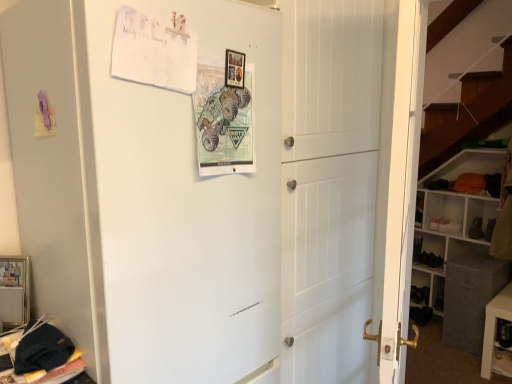
Question: Considering the relative sizes of black leather shoe at lower right, which ranks as the first shoe in right-to-left order, and white matte refrigerator at upper left in the image provided, is black leather shoe at lower right, which ranks as the first shoe in right-to-left order, smaller than white matte refrigerator at upper left?

Choices:
 (A) no
 (B) yes

Answer: (B)

Question: Is the position of black leather shoe at lower right, which ranks as the first shoe in right-to-left order, more distant than that of white matte refrigerator at upper left?

Choices:
 (A) yes
 (B) no

Answer: (A)

Question: Is black leather shoe at lower right, which ranks as the first shoe in right-to-left order, wider than white matte refrigerator at upper left?

Choices:
 (A) yes
 (B) no

Answer: (B)

Question: Can you confirm if black leather shoe at lower right, placed as the second shoe when sorted from left to right, is taller than white matte refrigerator at upper left?

Choices:
 (A) no
 (B) yes

Answer: (A)

Question: Considering the relative sizes of black leather shoe at lower right, placed as the second shoe when sorted from left to right, and white matte refrigerator at upper left in the image provided, is black leather shoe at lower right, placed as the second shoe when sorted from left to right, shorter than white matte refrigerator at upper left?

Choices:
 (A) no
 (B) yes

Answer: (B)

Question: In terms of height, does white paper postcard at upper left, which is the second postcard in right-to-left order, look taller or shorter compared to black fabric cabinet at lower right?

Choices:
 (A) short
 (B) tall

Answer: (A)

Question: Is white paper postcard at upper left, which appears as the 1th postcard when viewed from the left, to the left or to the right of black fabric cabinet at lower right in the image?

Choices:
 (A) left
 (B) right

Answer: (A)

Question: From the image's perspective, is white paper postcard at upper left, which is the second postcard in right-to-left order, positioned above or below black fabric cabinet at lower right?

Choices:
 (A) below
 (B) above

Answer: (B)

Question: Is white paper postcard at upper left, which appears as the 1th postcard when viewed from the left, spatially inside black fabric cabinet at lower right, or outside of it?

Choices:
 (A) inside
 (B) outside

Answer: (B)

Question: From a real-world perspective, is white wooden bookshelf at right positioned above or below matte paper postcard at center, placed as the 2th postcard when sorted from left to right?

Choices:
 (A) above
 (B) below

Answer: (B)

Question: In terms of width, does white wooden bookshelf at right look wider or thinner when compared to matte paper postcard at center, which ranks as the 1th postcard in right-to-left order?

Choices:
 (A) thin
 (B) wide

Answer: (B)

Question: Considering the relative positions of white wooden bookshelf at right and matte paper postcard at center, which ranks as the 1th postcard in right-to-left order, in the image provided, is white wooden bookshelf at right to the left or to the right of matte paper postcard at center, which ranks as the 1th postcard in right-to-left order,?

Choices:
 (A) left
 (B) right

Answer: (B)

Question: From the image's perspective, relative to matte paper postcard at center, placed as the 2th postcard when sorted from left to right, is white wooden bookshelf at right above or below?

Choices:
 (A) above
 (B) below

Answer: (B)

Question: Considering the positions of white paper postcard at upper left, which appears as the 1th postcard when viewed from the left, and white wooden bookshelf at right in the image, is white paper postcard at upper left, which appears as the 1th postcard when viewed from the left, wider or thinner than white wooden bookshelf at right?

Choices:
 (A) wide
 (B) thin

Answer: (B)

Question: Considering the positions of point (193, 76) and point (452, 292), is point (193, 76) closer or farther from the camera than point (452, 292)?

Choices:
 (A) farther
 (B) closer

Answer: (B)